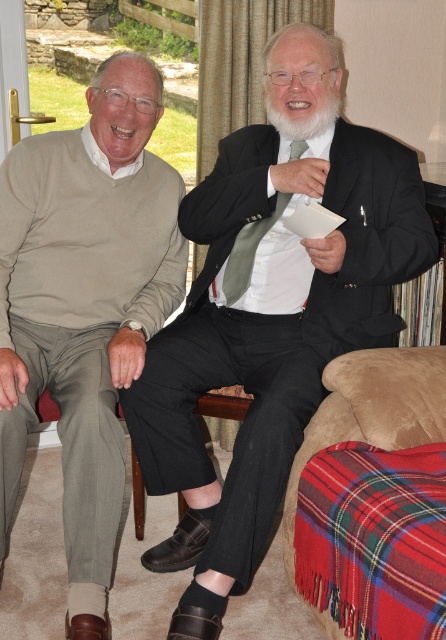
You are standing in the living room and need to find the light beige sweater at left. According to the coordinates provided, where exactly is it positioned?

The light beige sweater at left is located at point coordinates 0.480 on the x axis and 0.193 on the y axis.

You are a photographer who wants to capture a closeup of the whitehairbeard at center without including the green silk tie at center in the frame. Based on their positions, can you position yourself to the right or left side of the subjects to achieve this?

The green silk tie at center is to the left of whitehairbeard at center. To avoid including the green silk tie at center in the frame, you should position yourself to the right side of the subjects so that the whitehairbeard at center blocks the view of the green silk tie at center.